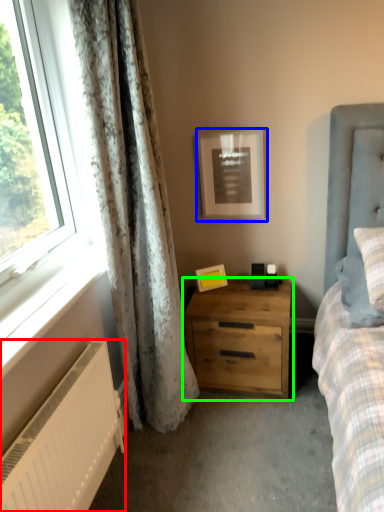
Question: Which is nearer to the radiator (highlighted by a red box)? picture frame (highlighted by a blue box) or nightstand (highlighted by a green box).

Choices:
 (A) picture frame
 (B) nightstand

Answer: (B)